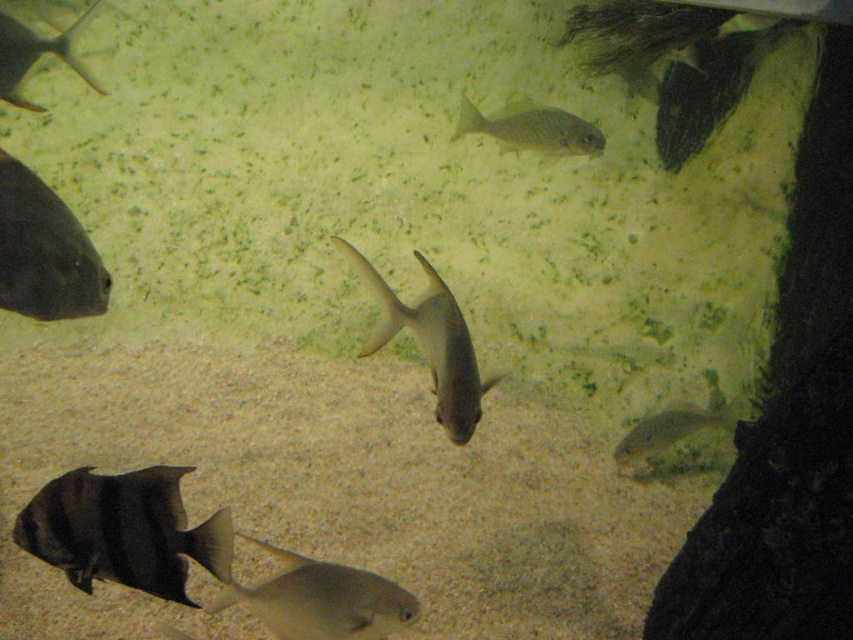
Question: Can you confirm if silvery metallic fish at center is smaller than matte black fish at upper left?

Choices:
 (A) no
 (B) yes

Answer: (A)

Question: Is black matte fish at lower left bigger than shiny silver fish at upper center?

Choices:
 (A) yes
 (B) no

Answer: (B)

Question: Among these objects, which one is farthest from the camera?

Choices:
 (A) smooth silver fish at bottom center
 (B) matte black fish at left
 (C) translucent gray fish at lower right

Answer: (C)

Question: Which point appears farthest from the camera in this image?

Choices:
 (A) (647, 444)
 (B) (26, 204)
 (C) (303, 570)

Answer: (A)

Question: Can you confirm if black matte fish at lower left is positioned to the left of matte black fish at left?

Choices:
 (A) no
 (B) yes

Answer: (A)

Question: Which of the following is the farthest from the observer?

Choices:
 (A) translucent gray fish at lower right
 (B) smooth silver fish at bottom center

Answer: (A)